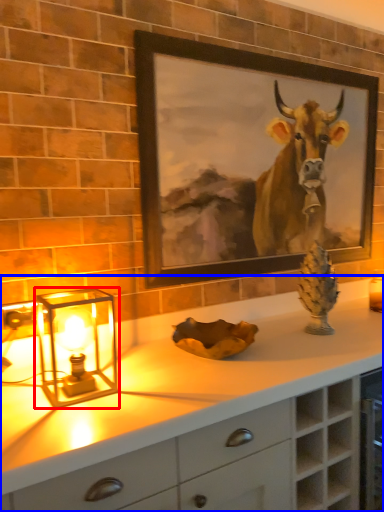
Question: Which object is further to the camera taking this photo, table lamp (highlighted by a red box) or countertop (highlighted by a blue box)?

Choices:
 (A) table lamp
 (B) countertop

Answer: (A)